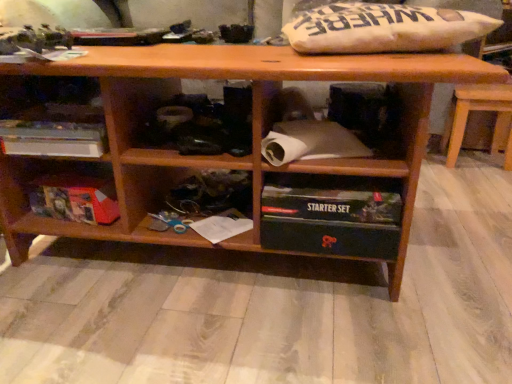
Identify the location of free space above black plastic starter set at lower center, the 1th shelf viewed from the right (from a real-world perspective). (334, 187).